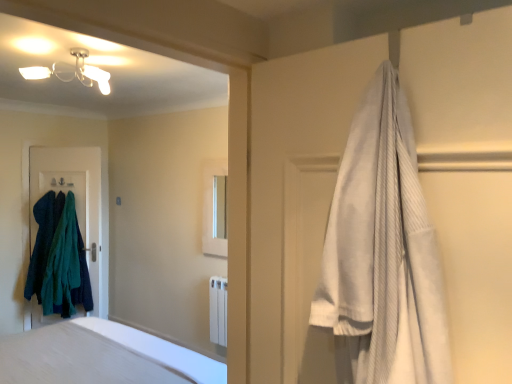
Question: Is the surface of white soft bed at center in direct contact with white cotton robe at upper right?

Choices:
 (A) yes
 (B) no

Answer: (B)

Question: Considering the relative sizes of white soft bed at center and white cotton robe at upper right in the image provided, is white soft bed at center thinner than white cotton robe at upper right?

Choices:
 (A) yes
 (B) no

Answer: (A)

Question: From a real-world perspective, is white soft bed at center located higher than white cotton robe at upper right?

Choices:
 (A) no
 (B) yes

Answer: (A)

Question: Can you confirm if white soft bed at center is shorter than white cotton robe at upper right?

Choices:
 (A) yes
 (B) no

Answer: (B)

Question: Does white soft bed at center come behind white cotton robe at upper right?

Choices:
 (A) yes
 (B) no

Answer: (A)

Question: Is white soft bed at center aimed at white cotton robe at upper right?

Choices:
 (A) no
 (B) yes

Answer: (B)

Question: From a real-world perspective, is white smooth bathtub at lower left physically above dark blue fabric at left?

Choices:
 (A) no
 (B) yes

Answer: (A)

Question: Can you confirm if white smooth bathtub at lower left is wider than dark blue fabric at left?

Choices:
 (A) yes
 (B) no

Answer: (A)

Question: Can you confirm if white smooth bathtub at lower left is thinner than dark blue fabric at left?

Choices:
 (A) no
 (B) yes

Answer: (A)

Question: Can you confirm if white smooth bathtub at lower left is positioned to the left of dark blue fabric at left?

Choices:
 (A) no
 (B) yes

Answer: (A)

Question: Could you tell me if white smooth bathtub at lower left is facing dark blue fabric at left?

Choices:
 (A) yes
 (B) no

Answer: (B)

Question: From the image's perspective, is white smooth bathtub at lower left on top of dark blue fabric at left?

Choices:
 (A) no
 (B) yes

Answer: (A)

Question: Is dark green fuzzy sweater at left, arranged as the second clothing when viewed from the right, turned away from white soft bed at center?

Choices:
 (A) yes
 (B) no

Answer: (B)